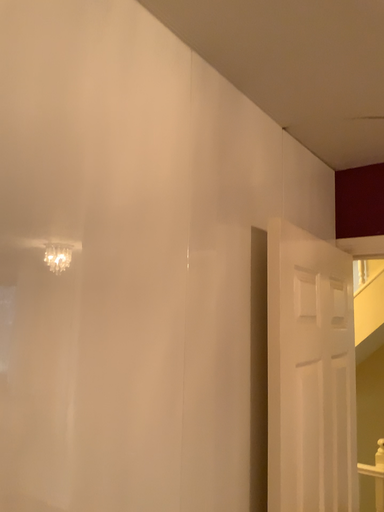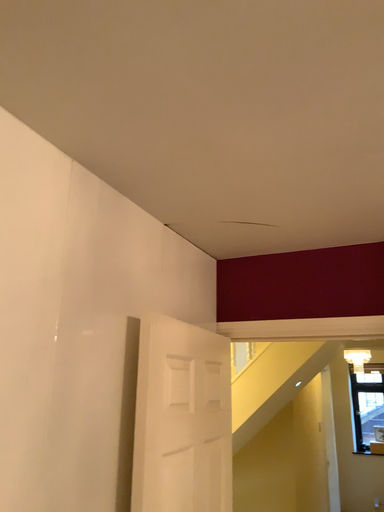
Question: Which way did the camera rotate in the video?

Choices:
 (A) rotated downward
 (B) rotated upward

Answer: (B)